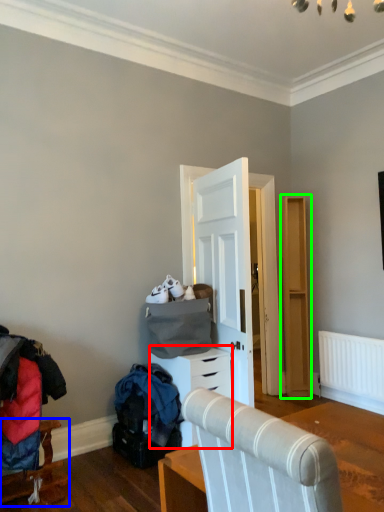
Question: Which object is positioned closest to chest of drawers (highlighted by a red box)? Select from furniture (highlighted by a blue box) and dresser (highlighted by a green box).

Choices:
 (A) furniture
 (B) dresser

Answer: (A)